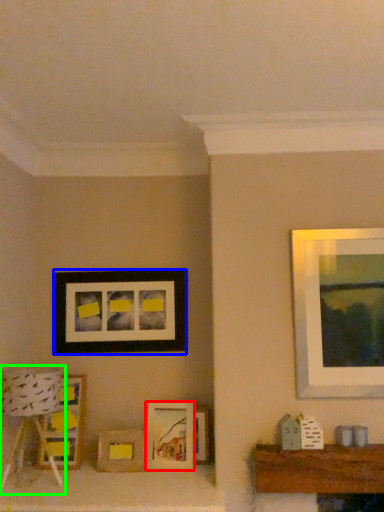
Question: Which object is the farthest from picture frame (highlighted by a red box)? Choose among these: picture frame (highlighted by a blue box) or lamp (highlighted by a green box).

Choices:
 (A) picture frame
 (B) lamp

Answer: (B)